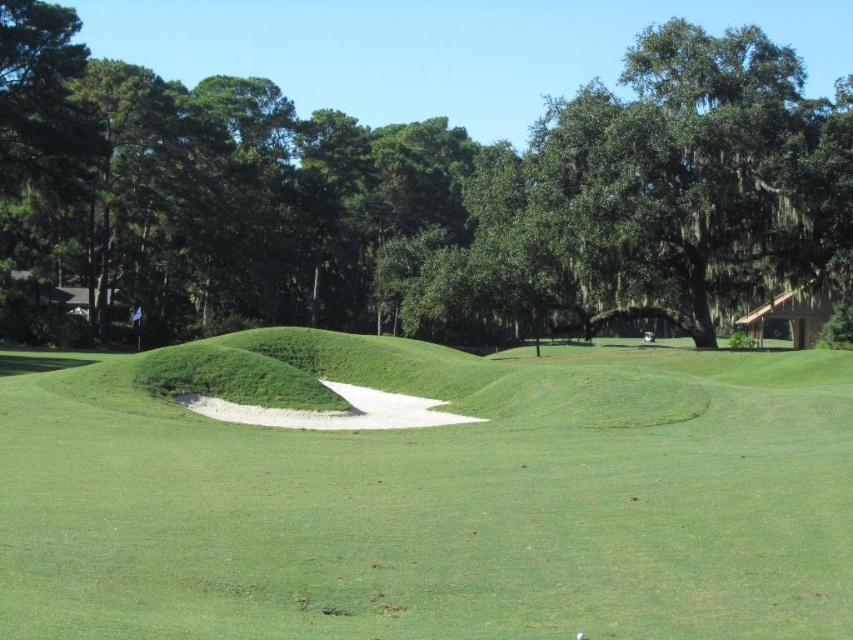
You are a golfer standing on the tee, facing the green sand bunker at center and the green leafy tree at center. Which object should you aim to hit your ball past first?

You should aim to hit your ball past the green sand bunker at center first because it is positioned to the left of the green leafy tree at center, meaning it is closer to your current position.

You are a golfer trying to decide which object to aim for between the green sand bunker at center and the green leafy tree at center. Considering their widths, which one is narrower?

The green sand bunker at center is thinner than the green leafy tree at center, so the green sand bunker at center is narrower.